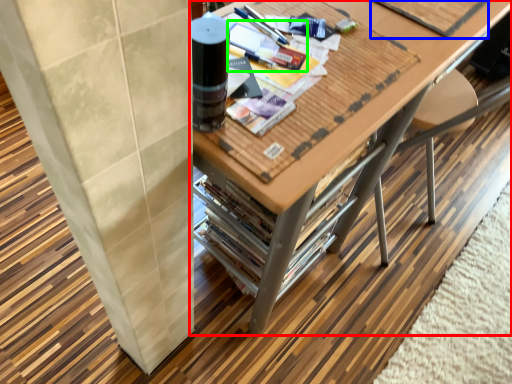
Question: Which object is the closest to the table (highlighted by a red box)? Choose among these: magazine (highlighted by a blue box) or magazine (highlighted by a green box).

Choices:
 (A) magazine
 (B) magazine

Answer: (A)